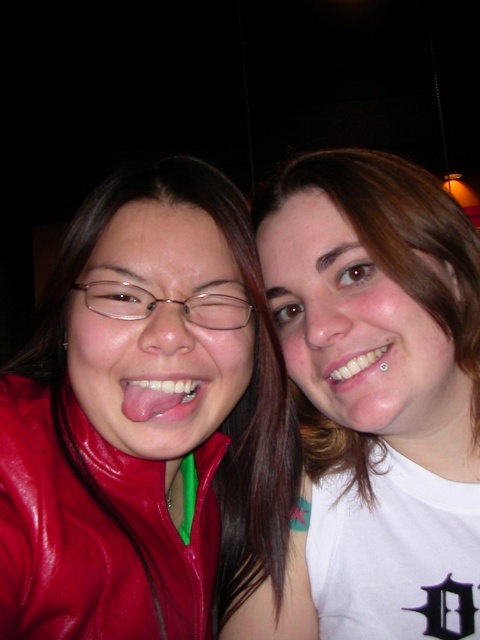
Question: Is shiny red jacket at center to the right of glossy leather jacket at lower left from the viewer's perspective?

Choices:
 (A) no
 (B) yes

Answer: (A)

Question: Which point is farther from the camera taking this photo?

Choices:
 (A) (337, 369)
 (B) (96, 532)
 (C) (301, 264)
 (D) (158, 394)

Answer: (C)

Question: Is white matte t-shirt at upper right further to the viewer compared to white glossy teeth at center?

Choices:
 (A) no
 (B) yes

Answer: (A)

Question: Among these points, which one is nearest to the camera?

Choices:
 (A) (90, 500)
 (B) (373, 195)
 (C) (41, 563)

Answer: (C)

Question: Does shiny red jacket at center have a larger size compared to matte white tongue at center?

Choices:
 (A) yes
 (B) no

Answer: (A)

Question: Among these points, which one is farthest from the camera?

Choices:
 (A) [x=163, y=355]
 (B) [x=358, y=372]

Answer: (B)